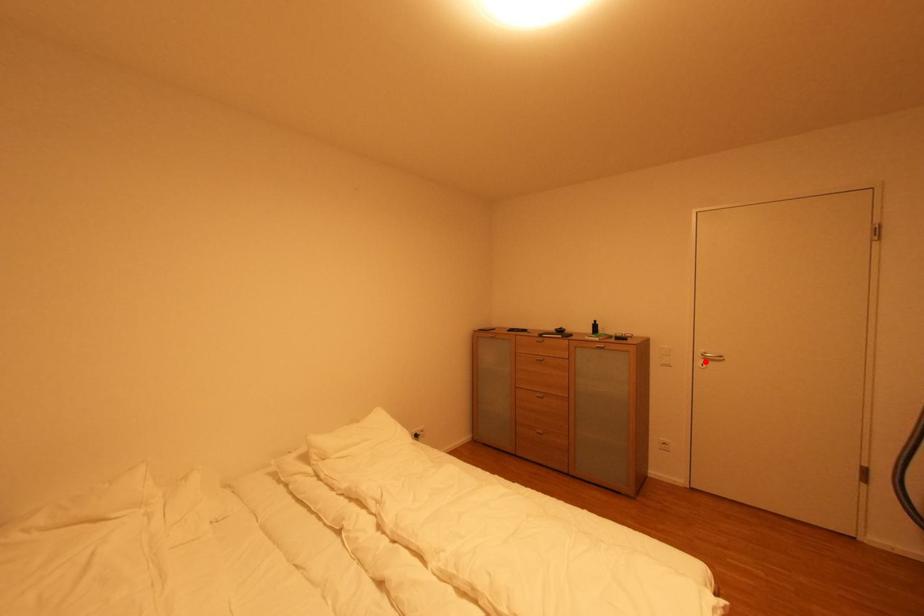
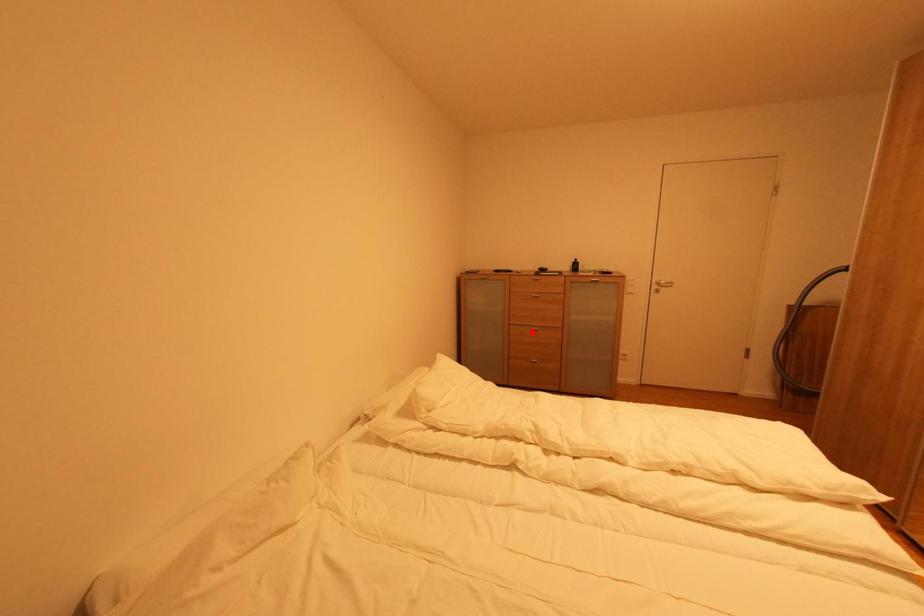
I am providing you with two images of the same scene from different viewpoints. A red point is marked on the first image and another point is marked on the second image. Do the highlighted points in image1 and image2 indicate the same real-world spot?

No